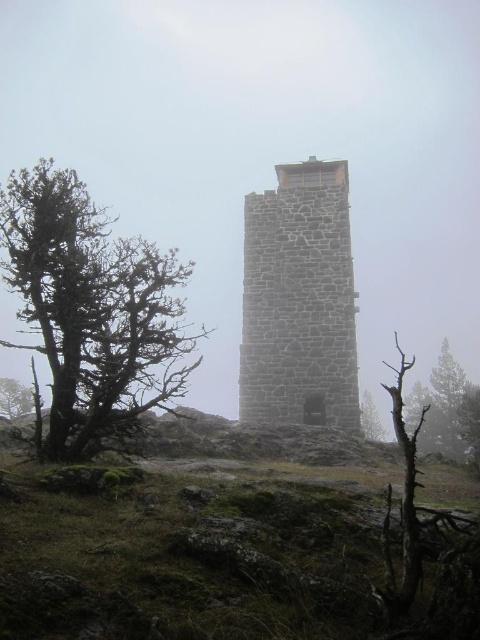
You are standing at the base of the stone tower and notice two bare wood trees in the foreground. Which tree, the bare wood tree at left or the bare wood tree at center, is located more to the left side of the scene?

The bare wood tree at left is positioned on the left side of the bare wood tree at center, so it is more to the left in the scene.